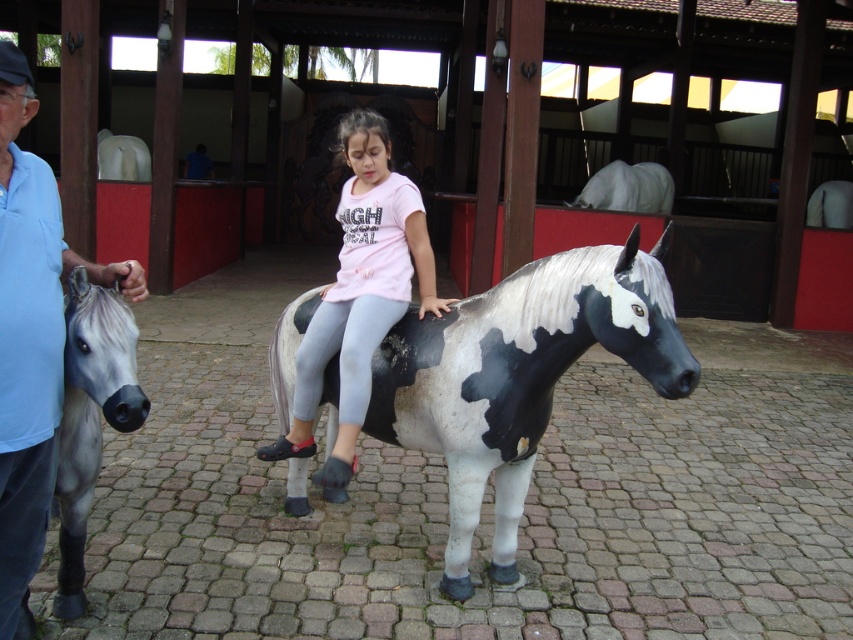
Question: Does smooth gray horse at left appear on the left side of matte pink shirt at center?

Choices:
 (A) no
 (B) yes

Answer: (B)

Question: Which point appears closest to the camera in this image?

Choices:
 (A) (71, 435)
 (B) (3, 440)
 (C) (380, 320)
 (D) (450, 566)

Answer: (B)

Question: Which of the following is the closest to the observer?

Choices:
 (A) (74, 342)
 (B) (357, 145)

Answer: (A)

Question: Can you confirm if matte pink shirt at center is bigger than gray matte horse at left?

Choices:
 (A) yes
 (B) no

Answer: (A)

Question: Can you confirm if smooth gray horse at left is wider than gray matte horse at left?

Choices:
 (A) yes
 (B) no

Answer: (B)

Question: Which of the following is the closest to the observer?

Choices:
 (A) (90, 410)
 (B) (648, 352)
 (C) (45, 355)
 (D) (341, 326)

Answer: (C)